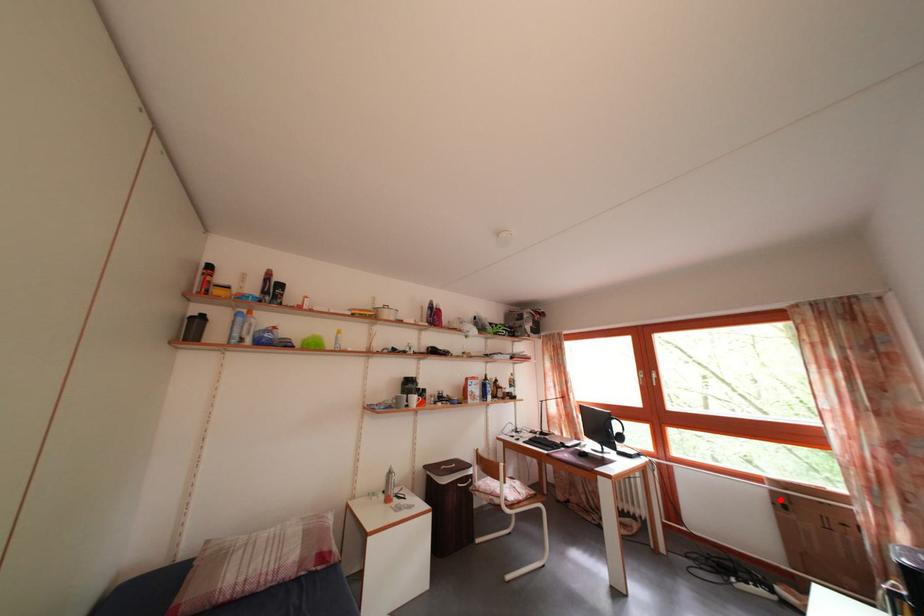
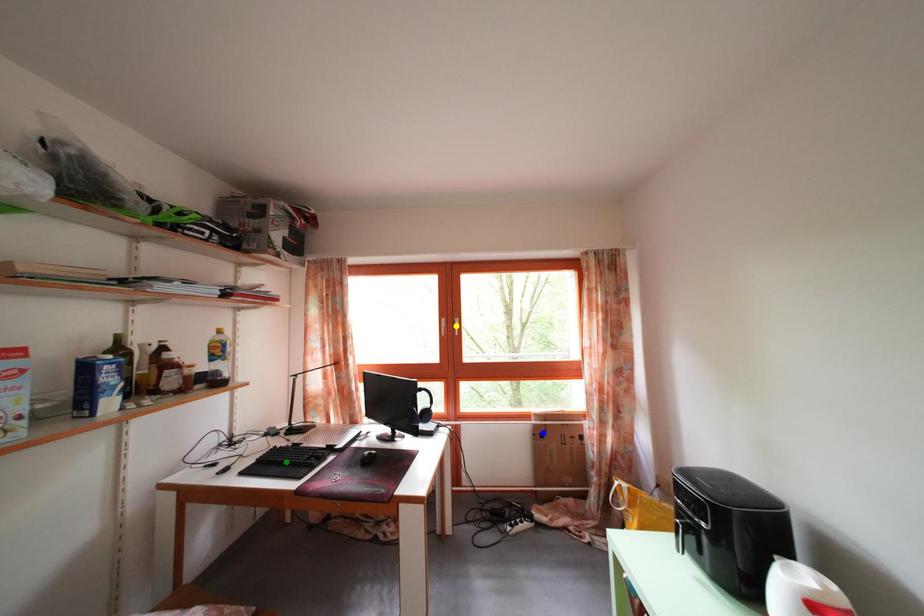
Question: I am providing you with two images of the same scene from different viewpoints. A red point is marked on the first image. You are given multiple points on the second image. Which point in image 2 represents the same 3d spot as the red point in image 1?

Choices:
 (A) blue point
 (B) yellow point
 (C) green point

Answer: (A)